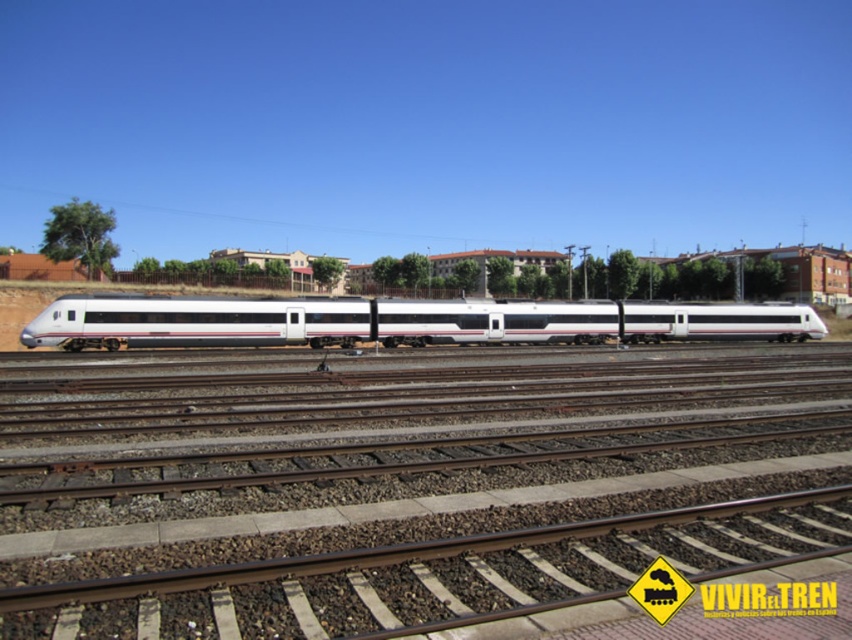
This screenshot has width=852, height=640. What do you see at coordinates (422, 452) in the screenshot? I see `brown gravel at center` at bounding box center [422, 452].

Is point (62, 497) more distant than point (642, 301)?

No, it is in front of (642, 301).

Locate an element on the screen. The image size is (852, 640). brown gravel at center is located at coordinates (422, 452).